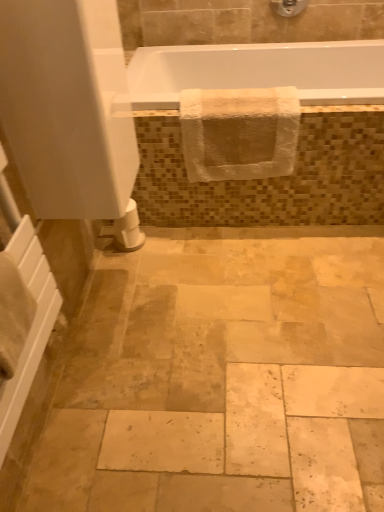
Question: From a real-world perspective, is white glossy bathtub at upper center above or below white glossy bathtub at upper center?

Choices:
 (A) above
 (B) below

Answer: (B)

Question: Is white glossy bathtub at upper center inside the boundaries of white glossy bathtub at upper center, or outside?

Choices:
 (A) inside
 (B) outside

Answer: (B)

Question: Which is nearer to the matte silver showerhead at upper center?

Choices:
 (A) white glossy bathtub at upper center
 (B) white matte screen door at upper left
 (C) white glossy bathtub at upper center
 (D) white matte toilet paper at lower left
 (E) white textured towel at upper center

Answer: (C)

Question: Estimate the real-world distances between objects in this image. Which object is farther from the matte silver showerhead at upper center?

Choices:
 (A) white matte toilet paper at lower left
 (B) white glossy bathtub at upper center
 (C) white matte screen door at upper left
 (D) white glossy bathtub at upper center
 (E) white textured towel at upper center

Answer: (C)